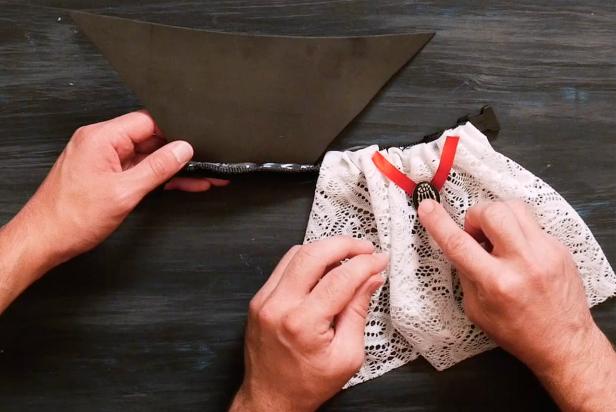
Find the location of a particular element. Image resolution: width=616 pixels, height=412 pixels. wooden surface is located at coordinates (198, 291).